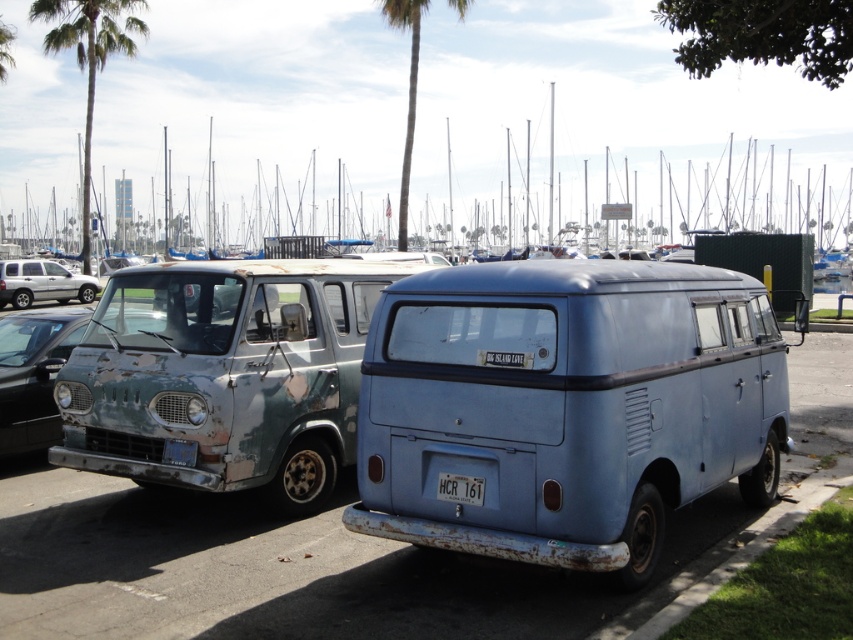
Does point (328, 493) lie behind point (27, 269)?

No, (328, 493) is closer to viewer.

Is rusty metal van at left bigger than silver metallic suv at left?

Yes, rusty metal van at left is bigger than silver metallic suv at left.

Does point (144, 444) come in front of point (20, 307)?

Yes, it is in front of point (20, 307).

Where is `rusty metal van at left`? rusty metal van at left is located at coordinates (224, 374).

Can you confirm if light blue matte van at center is positioned above green leafy palm tree at upper left?

Actually, light blue matte van at center is below green leafy palm tree at upper left.

Who is higher up, light blue matte van at center or green leafy palm tree at upper left?

Positioned higher is green leafy palm tree at upper left.

Is point (619, 545) in front of point (131, 51)?

Yes, it is in front of point (131, 51).

Where is `light blue matte van at center`? The image size is (853, 640). light blue matte van at center is located at coordinates (566, 406).

Who is lower down, rusty metal van at left or green leafy palm tree at center?

Positioned lower is rusty metal van at left.

Is rusty metal van at left above green leafy palm tree at center?

No.

Who is more forward, [148,337] or [401,188]?

Point [148,337] is more forward.

Where is `rusty metal van at left`? The image size is (853, 640). rusty metal van at left is located at coordinates (224, 374).